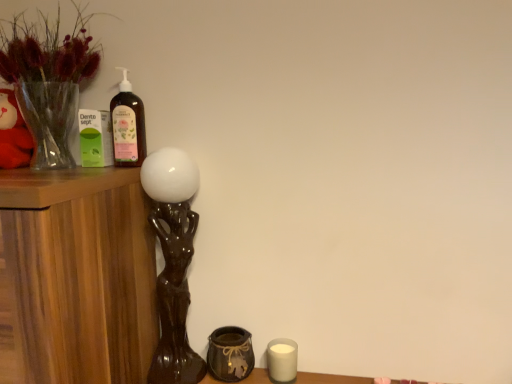
Question: Relative to translucent glass bottle at upper left, is brown glossy table lamp at left in front or behind?

Choices:
 (A) front
 (B) behind

Answer: (A)

Question: From their relative heights in the image, would you say brown glossy table lamp at left is taller or shorter than translucent glass bottle at upper left?

Choices:
 (A) short
 (B) tall

Answer: (B)

Question: Which object is the closest to the brown glossy table lamp at left?

Choices:
 (A) white matte candle at lower right
 (B) translucent glass vase at upper left
 (C) translucent glass bottle at upper left
 (D) brown textured vase at lower center

Answer: (D)

Question: Which is nearer to the brown textured vase at lower center?

Choices:
 (A) translucent glass vase at upper left
 (B) translucent glass bottle at upper left
 (C) brown glossy table lamp at left
 (D) white matte candle at lower right

Answer: (D)